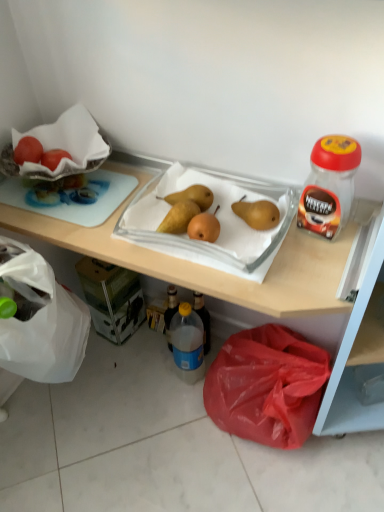
Question: From a real-world perspective, is translucent plastic jar at right physically located above or below wooden tray at upper center?

Choices:
 (A) below
 (B) above

Answer: (B)

Question: Is point tap(337, 181) closer or farther from the camera than point tap(304, 234)?

Choices:
 (A) farther
 (B) closer

Answer: (B)

Question: Which is farther from the matte white grapefruit at upper left?

Choices:
 (A) translucent plastic jar at right
 (B) wooden tray at upper center
 (C) red plastic bag at lower center
 (D) translucent plastic bottle at lower center
 (E) smooth brown pears at center

Answer: (C)

Question: Considering the real-world distances, which object is closest to the translucent plastic jar at right?

Choices:
 (A) red plastic bag at lower center
 (B) translucent plastic bottle at lower center
 (C) matte white grapefruit at upper left
 (D) smooth brown pears at center
 (E) wooden tray at upper center

Answer: (D)